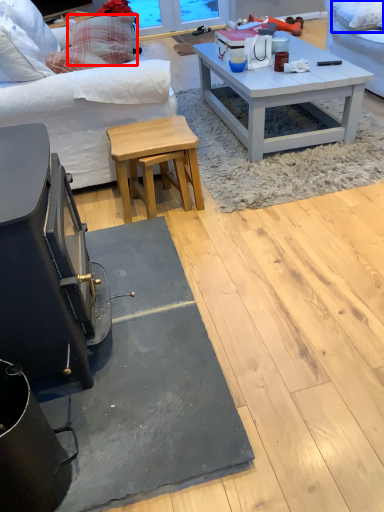
Question: Which object appears closest to the camera in this image, pillow (highlighted by a red box) or pillow (highlighted by a blue box)?

Choices:
 (A) pillow
 (B) pillow

Answer: (B)